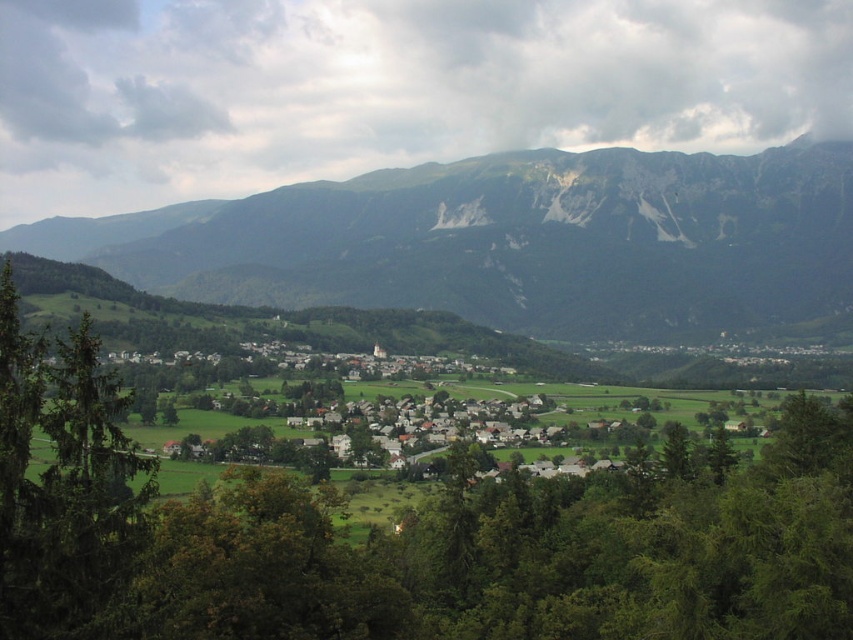
Between green rocky mountain at upper center and green leafy tree at left, which one appears on the left side from the viewer's perspective?

From the viewer's perspective, green leafy tree at left appears more on the left side.

Who is more forward, (430, 209) or (3, 493)?

Point (3, 493)

Find the location of a particular element. green rocky mountain at upper center is located at coordinates tap(512, 241).

Is green leafy tree at center above green rocky mountain at upper center?

Actually, green leafy tree at center is below green rocky mountain at upper center.

Which is in front, point (834, 508) or point (646, 182)?

Point (834, 508) is in front.

The height and width of the screenshot is (640, 853). Describe the element at coordinates (410, 536) in the screenshot. I see `green leafy tree at center` at that location.

You are a GUI agent. You are given a task and a screenshot of the screen. Output one action in this format:
    pyautogui.click(x=<x>, y=<y>)
    Task: Click on the green leafy tree at center
    
    Given the screenshot: What is the action you would take?
    pyautogui.click(x=410, y=536)

Is point (698, 464) positioned after point (80, 554)?

Yes, point (698, 464) is behind point (80, 554).

Is green leafy tree at center to the left of green leafy tree at left from the viewer's perspective?

In fact, green leafy tree at center is to the right of green leafy tree at left.

This screenshot has width=853, height=640. Identify the location of green leafy tree at center. (410, 536).